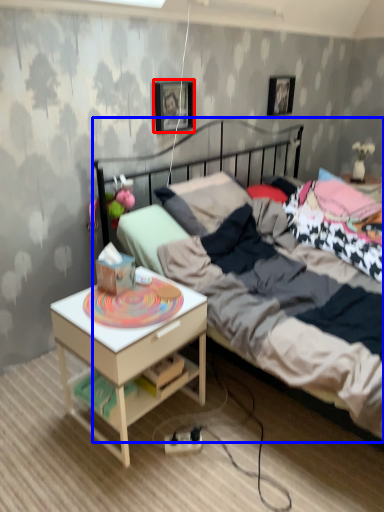
Question: Which object is closer to the camera taking this photo, picture frame (highlighted by a red box) or bed (highlighted by a blue box)?

Choices:
 (A) picture frame
 (B) bed

Answer: (B)